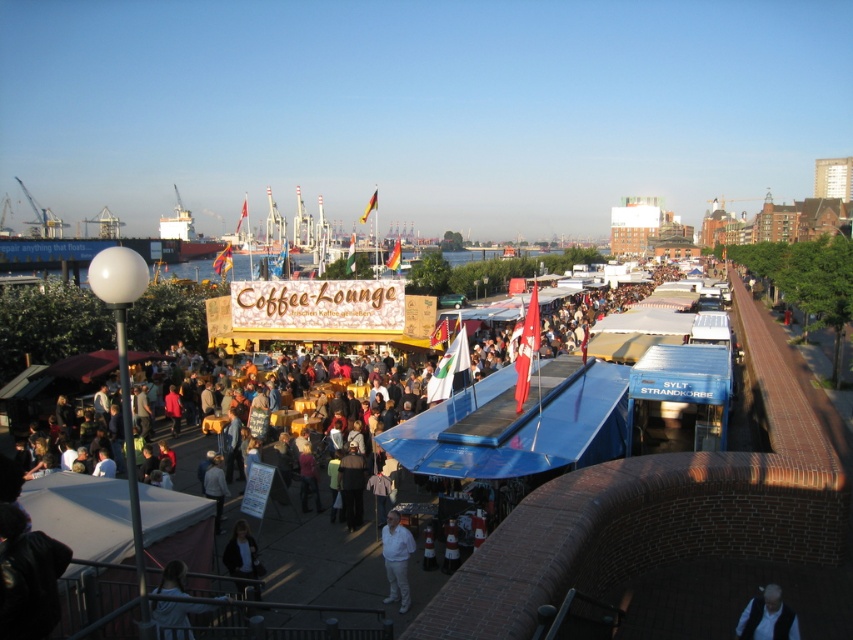
Who is shorter, dark gray wool jacket at lower right or white cotton shirt at center?

Standing shorter between the two is white cotton shirt at center.

This screenshot has height=640, width=853. What do you see at coordinates (767, 618) in the screenshot? I see `dark gray wool jacket at lower right` at bounding box center [767, 618].

Locate an element on the screen. Image resolution: width=853 pixels, height=640 pixels. dark gray wool jacket at lower right is located at coordinates (767, 618).

Is dark gray wool jacket at lower right to the left of dark gray sweater at center from the viewer's perspective?

No, dark gray wool jacket at lower right is not to the left of dark gray sweater at center.

The width and height of the screenshot is (853, 640). Describe the element at coordinates (767, 618) in the screenshot. I see `dark gray wool jacket at lower right` at that location.

Identify the location of dark gray wool jacket at lower right. The image size is (853, 640). (767, 618).

Between white cotton shirt at center and dark blue jacket at lower center, which one has more height?

Standing taller between the two is dark blue jacket at lower center.

Can you confirm if white cotton shirt at center is positioned to the left of dark blue jacket at lower center?

No, white cotton shirt at center is not to the left of dark blue jacket at lower center.

Is point (405, 588) positioned behind point (224, 564)?

That is False.

Image resolution: width=853 pixels, height=640 pixels. I want to click on white cotton shirt at center, so click(396, 560).